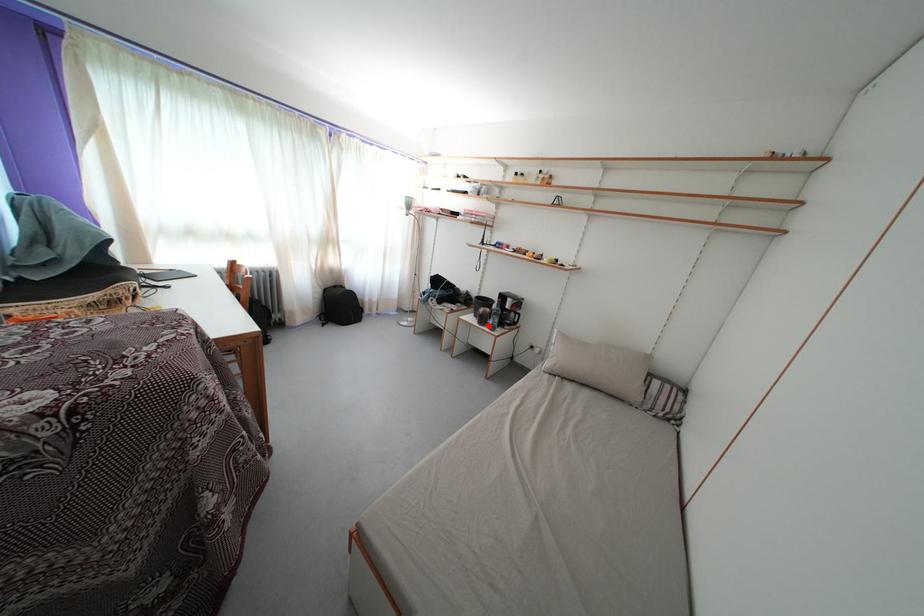
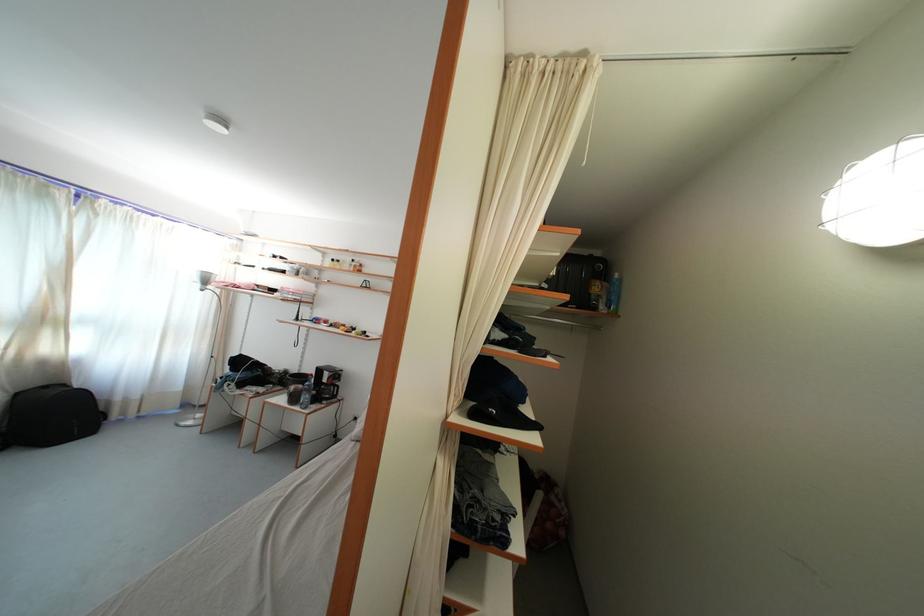
Question: I am providing you with two images of the same scene from different viewpoints. A red point is shown in image1. For the corresponding object point in image2, is it positioned nearer or farther from the camera?

Choices:
 (A) Nearer
 (B) Farther

Answer: (B)